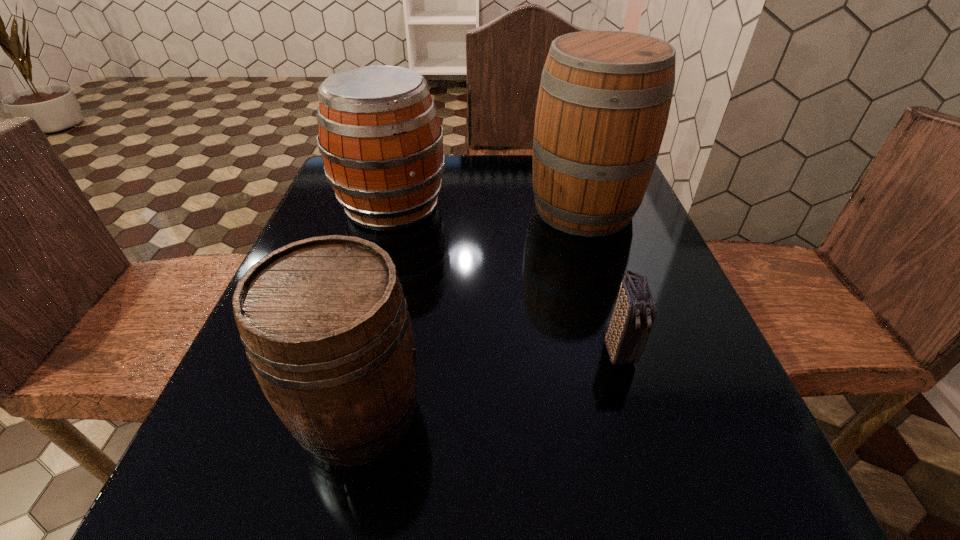
Image resolution: width=960 pixels, height=540 pixels. I want to click on object present at the far left corner, so click(x=381, y=142).

Where is `object situated at the near left corner`? object situated at the near left corner is located at coordinates (x=326, y=328).

I want to click on object present at the far right corner, so click(x=604, y=99).

At what (x,y) coordinates should I click in order to perform the action: click on vacant space at the far edge. Please return your answer as a coordinate pair (x, y). Looking at the image, I should click on (449, 185).

In the image, there is a desktop. Where is `vacant space at the near edge`? The height and width of the screenshot is (540, 960). vacant space at the near edge is located at coordinates (612, 504).

Find the location of a particular element. vacant area at the right edge of the desktop is located at coordinates (614, 262).

The width and height of the screenshot is (960, 540). What are the coordinates of `vacant space at the near right corner of the desktop` in the screenshot? It's located at (717, 462).

Find the location of a particular element. The width and height of the screenshot is (960, 540). vacant space that is in between the nearest cider and the tallest cider is located at coordinates (471, 310).

At what (x,y) coordinates should I click in order to perform the action: click on vacant area that lies between the clutch bag and the tallest object. Please return your answer as a coordinate pair (x, y). Looking at the image, I should click on (601, 279).

Where is `free space that is in between the rightmost cider and the shortest object`? The width and height of the screenshot is (960, 540). free space that is in between the rightmost cider and the shortest object is located at coordinates (601, 279).